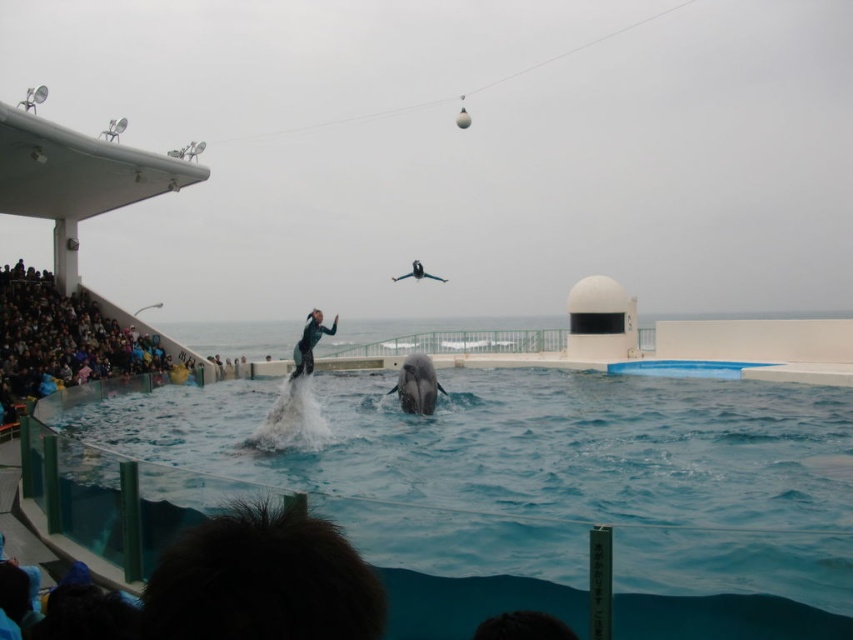
You are a marine trainer standing at the edge of the pool. You need to throw a fish to the clear blue water at lower center. The crowd is at dark blue fabric crowd at lower left. Can you safely throw the fish without it landing in the crowd?

The distance between the clear blue water at lower center and the dark blue fabric crowd at lower left is 26.72 meters. Since the crowd is 26.72 meters away from the water, you can safely throw the fish to the clear blue water at lower center without it reaching the crowd.

You are a photographer positioned at the front row of the marine park. You want to capture a photo of the clear blue water at lower center without the dark blue fabric crowd at lower left blocking the view. Is this possible given their positions?

Yes, the clear blue water at lower center is closer to the viewer than the dark blue fabric crowd at lower left, so the photographer can capture the clear blue water at lower center without obstruction from the crowd.